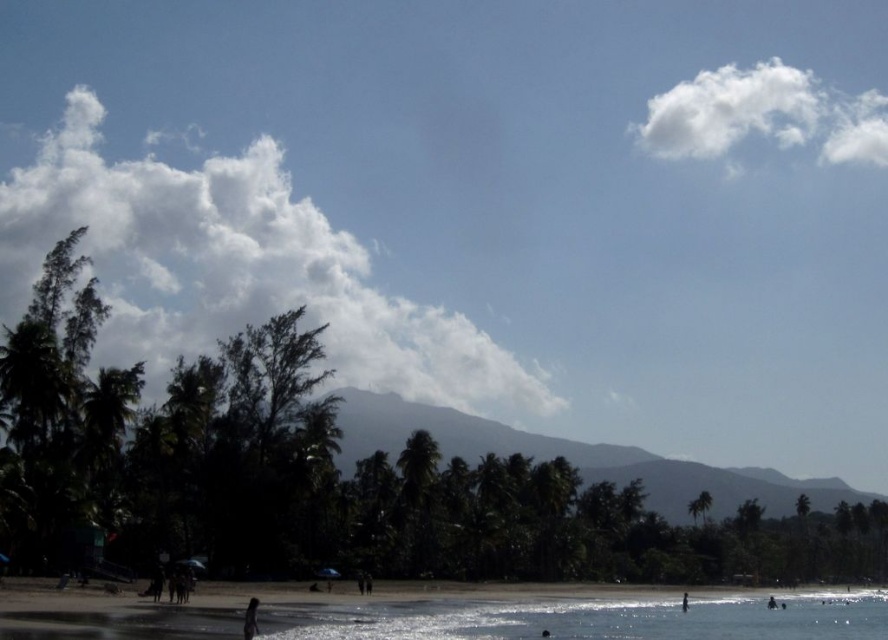
Question: Can you confirm if white fluffy cloud at upper left is positioned above white fluffy cloud at upper right?

Choices:
 (A) yes
 (B) no

Answer: (B)

Question: Can you confirm if white fluffy cloud at upper left is positioned to the left of dark skin human at lower center?

Choices:
 (A) yes
 (B) no

Answer: (A)

Question: Is white fluffy cloud at upper left bigger than dark skin human at lower right?

Choices:
 (A) yes
 (B) no

Answer: (A)

Question: Which point is farther from the camera taking this photo?

Choices:
 (A) (746, 90)
 (B) (250, 605)
 (C) (686, 596)

Answer: (A)

Question: Which object is positioned closest to the smooth sand beach at lower center?

Choices:
 (A) dark skin human at lower center
 (B) dark skin human at lower right

Answer: (B)

Question: Among these points, which one is farthest from the camera?

Choices:
 (A) (252, 604)
 (B) (434, 609)

Answer: (B)